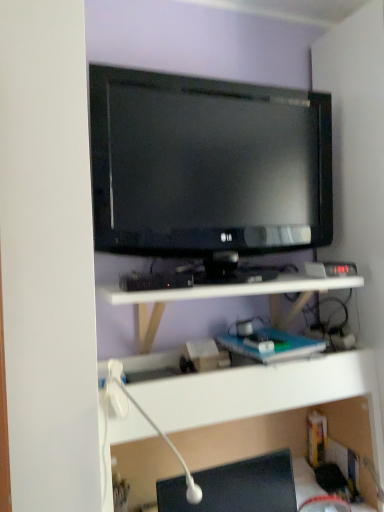
In order to face white matte shelf at center, which is the second shelf in bottom-to-top order, should I rotate leftwards or rightwards?

You should look right and rotate roughly 5.175 degrees.

What is the approximate width of matte black tv at upper center?

2.28 inches.

Where is `white plastic lamp at lower center`? The width and height of the screenshot is (384, 512). white plastic lamp at lower center is located at coordinates (146, 420).

How much space does white plastic shelf at lower center, the 1th shelf in the bottom-to-top sequence, occupy vertically?

It is 28.06 inches.

Identify the location of white matte shelf at center, which is counted as the first shelf, starting from the top. This screenshot has width=384, height=512. (224, 297).

In the scene shown: Are white plastic shelf at lower center, the 2th shelf from the top, and white matte shelf at center, which is the second shelf in bottom-to-top order, far apart?

white plastic shelf at lower center, the 2th shelf from the top, is actually quite close to white matte shelf at center, which is the second shelf in bottom-to-top order.

Can you confirm if white plastic shelf at lower center, the 1th shelf in the bottom-to-top sequence, is taller than white matte shelf at center, which is the second shelf in bottom-to-top order?

Indeed, white plastic shelf at lower center, the 1th shelf in the bottom-to-top sequence, has a greater height compared to white matte shelf at center, which is the second shelf in bottom-to-top order.

Do you think white plastic shelf at lower center, the 2th shelf from the top, is within white matte shelf at center, which is counted as the first shelf, starting from the top, or outside of it?

white plastic shelf at lower center, the 2th shelf from the top, exists outside the volume of white matte shelf at center, which is counted as the first shelf, starting from the top.

Which object is closer to the camera, white plastic shelf at lower center, the 1th shelf in the bottom-to-top sequence, or white matte shelf at center, which is counted as the first shelf, starting from the top?

white plastic shelf at lower center, the 1th shelf in the bottom-to-top sequence, is more forward.

Does white matte shelf at center, which is the second shelf in bottom-to-top order, have a lesser height compared to black glossy desktop at lower right?

No, white matte shelf at center, which is the second shelf in bottom-to-top order, is not shorter than black glossy desktop at lower right.

What's the angular difference between white matte shelf at center, which is counted as the first shelf, starting from the top, and black glossy desktop at lower right's facing directions?

white matte shelf at center, which is counted as the first shelf, starting from the top, and black glossy desktop at lower right are facing 0.0879 degrees away from each other.

Can black glossy desktop at lower right be found inside white matte shelf at center, which is counted as the first shelf, starting from the top?

That's incorrect, black glossy desktop at lower right is not inside white matte shelf at center, which is counted as the first shelf, starting from the top.

Consider the image. Can you confirm if black glossy desktop at lower right is positioned to the right of matte black tv at upper center?

Yes, black glossy desktop at lower right is to the right of matte black tv at upper center.

Which object is further away from the camera, black glossy desktop at lower right or matte black tv at upper center?

matte black tv at upper center is behind.

Is black glossy desktop at lower right far away from matte black tv at upper center?

black glossy desktop at lower right is near matte black tv at upper center, not far away.

Image resolution: width=384 pixels, height=512 pixels. Find the location of `lamp below the matte black tv at upper center (from the image's perspective)`. lamp below the matte black tv at upper center (from the image's perspective) is located at coordinates (146, 420).

From the image's perspective, which is above, matte black tv at upper center or white plastic lamp at lower center?

matte black tv at upper center, from the image's perspective.

Does matte black tv at upper center have a greater height compared to white plastic lamp at lower center?

Correct, matte black tv at upper center is much taller as white plastic lamp at lower center.

Considering the relative positions of white matte shelf at center, which is the second shelf in bottom-to-top order, and matte black tv at upper center in the image provided, is white matte shelf at center, which is the second shelf in bottom-to-top order, to the left or to the right of matte black tv at upper center?

Clearly, white matte shelf at center, which is the second shelf in bottom-to-top order, is on the right of matte black tv at upper center in the image.

What are the coordinates of `television behind the white matte shelf at center, which is counted as the first shelf, starting from the top` in the screenshot? It's located at (207, 166).

Is white matte shelf at center, which is the second shelf in bottom-to-top order, not within matte black tv at upper center?

Yes, white matte shelf at center, which is the second shelf in bottom-to-top order, is not within matte black tv at upper center.

Does point (341, 276) appear closer or farther from the camera than point (186, 208)?

Point (341, 276) is farther from the camera than point (186, 208).

Image resolution: width=384 pixels, height=512 pixels. Identify the location of lamp behind the black glossy desktop at lower right. (146, 420).

From a real-world perspective, is white plastic lamp at lower center physically located above or below black glossy desktop at lower right?

white plastic lamp at lower center is above black glossy desktop at lower right.

Which object is positioned more to the right, white plastic lamp at lower center or black glossy desktop at lower right?

From the viewer's perspective, black glossy desktop at lower right appears more on the right side.

How different are the orientations of white plastic lamp at lower center and black glossy desktop at lower right in degrees?

They differ by 0.000897 degrees in their facing directions.

From a real-world perspective, who is located lower, white plastic shelf at lower center, the 1th shelf in the bottom-to-top sequence, or black glossy desktop at lower right?

From a 3D spatial view, white plastic shelf at lower center, the 1th shelf in the bottom-to-top sequence, is below.

In the scene shown: Is black glossy desktop at lower right at the back of white plastic shelf at lower center, the 2th shelf from the top?

Yes, white plastic shelf at lower center, the 2th shelf from the top,'s orientation is away from black glossy desktop at lower right.

Could you measure the distance between white plastic shelf at lower center, the 1th shelf in the bottom-to-top sequence, and black glossy desktop at lower right?

white plastic shelf at lower center, the 1th shelf in the bottom-to-top sequence, is 9.42 inches from black glossy desktop at lower right.

How different are the orientations of white plastic shelf at lower center, the 1th shelf in the bottom-to-top sequence, and black glossy desktop at lower right in degrees?

0.7 degrees.

Identify the location of shelf that appears above the white plastic shelf at lower center, the 1th shelf in the bottom-to-top sequence (from the image's perspective). This screenshot has width=384, height=512. (224, 297).

Locate an element on the screen. desktop that appears below the white matte shelf at center, which is the second shelf in bottom-to-top order (from the image's perspective) is located at coordinates (236, 487).

Considering their positions, is white plastic shelf at lower center, the 2th shelf from the top, positioned closer to black glossy desktop at lower right than matte black tv at upper center?

The object closer to black glossy desktop at lower right is white plastic shelf at lower center, the 2th shelf from the top.

Considering their positions, is matte black tv at upper center positioned closer to black glossy desktop at lower right than white matte shelf at center, which is the second shelf in bottom-to-top order?

white matte shelf at center, which is the second shelf in bottom-to-top order.

Looking at this image, when comparing their distances from white plastic shelf at lower center, the 2th shelf from the top, does black glossy desktop at lower right or white plastic lamp at lower center seem further?

white plastic lamp at lower center is further to white plastic shelf at lower center, the 2th shelf from the top.

When comparing their distances from black glossy desktop at lower right, does white plastic shelf at lower center, the 1th shelf in the bottom-to-top sequence, or white plastic lamp at lower center seem closer?

The object closer to black glossy desktop at lower right is white plastic shelf at lower center, the 1th shelf in the bottom-to-top sequence.

Based on the photo, looking at the image, which one is located closer to white plastic lamp at lower center, matte black tv at upper center or white matte shelf at center, which is the second shelf in bottom-to-top order?

white matte shelf at center, which is the second shelf in bottom-to-top order.

Based on their spatial positions, is white plastic lamp at lower center or black glossy desktop at lower right closer to white plastic shelf at lower center, the 2th shelf from the top?

black glossy desktop at lower right lies closer to white plastic shelf at lower center, the 2th shelf from the top, than the other object.

When comparing their distances from matte black tv at upper center, does white plastic shelf at lower center, the 2th shelf from the top, or white matte shelf at center, which is the second shelf in bottom-to-top order, seem closer?

white matte shelf at center, which is the second shelf in bottom-to-top order.

From the image, which object appears to be farther from white plastic lamp at lower center, white plastic shelf at lower center, the 2th shelf from the top, or black glossy desktop at lower right?

white plastic shelf at lower center, the 2th shelf from the top, is further to white plastic lamp at lower center.

Find the location of a particular element. Image resolution: width=384 pixels, height=512 pixels. lamp that lies between matte black tv at upper center and black glossy desktop at lower right from top to bottom is located at coordinates (146, 420).

Identify the location of desktop located between white plastic lamp at lower center and white plastic shelf at lower center, the 2th shelf from the top, in the left-right direction. (236, 487).

Identify the location of shelf between matte black tv at upper center and white plastic lamp at lower center in the vertical direction. (224, 297).

The image size is (384, 512). Identify the location of shelf that lies between matte black tv at upper center and white plastic shelf at lower center, the 2th shelf from the top, from top to bottom. (224, 297).